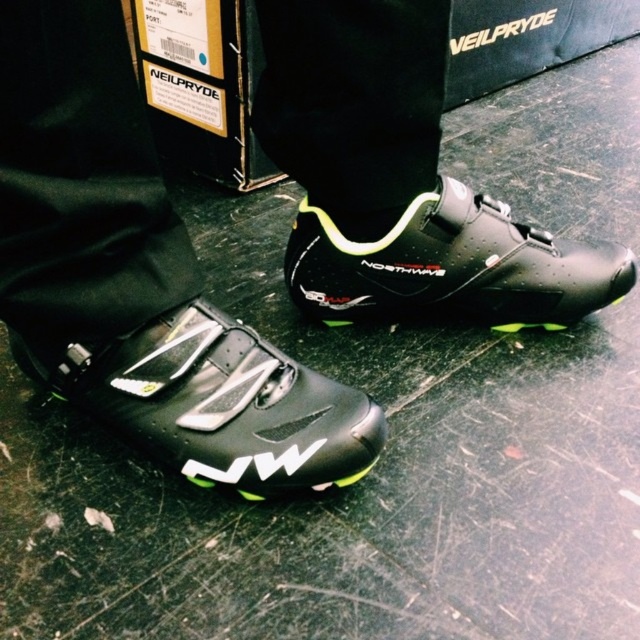
You are standing in a room with a pair of cycling shoes and a bag. The shoes have a buckle closure and neon green accents. The bag has the text NEILPRYDE on it. There is a point marked at coordinates (214, 403). Which object is located at this point?

The point at coordinates (214, 403) corresponds to the matte black cycling shoe at lower center.